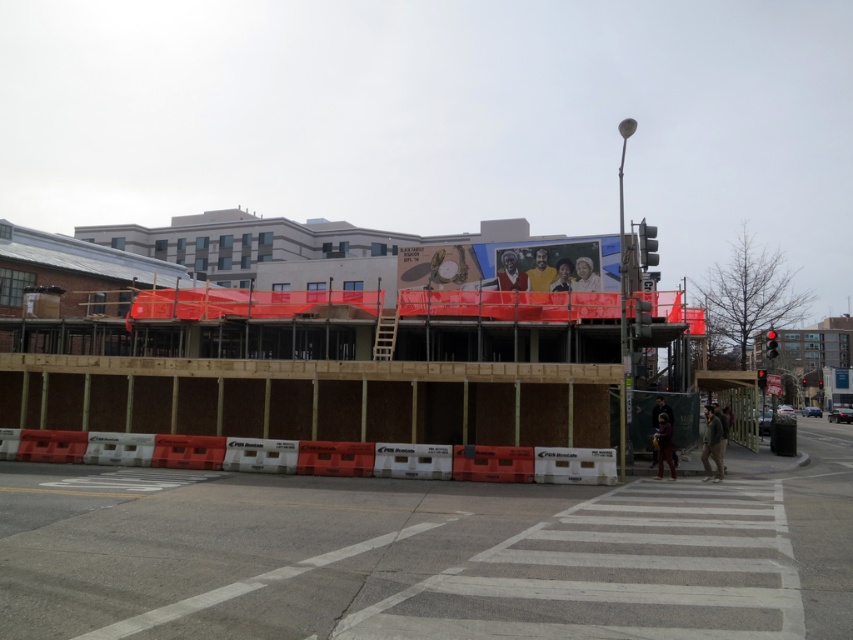
Question: Estimate the real-world distances between objects in this image. Which object is farther from the red glass traffic light at center?

Choices:
 (A) white plastic barricade at lower center
 (B) red glass traffic light at upper right

Answer: (A)

Question: Where is white plastic barricade at lower center located in relation to red glass traffic light at center in the image?

Choices:
 (A) above
 (B) below

Answer: (B)

Question: Which of the following is the farthest from the observer?

Choices:
 (A) red glass traffic light at center
 (B) white plastic barricade at lower center

Answer: (A)

Question: Which object is farther from the camera taking this photo?

Choices:
 (A) white plastic barricade at lower center
 (B) red glass traffic light at center

Answer: (B)

Question: Can you confirm if white plastic barricade at lower center is smaller than red glass traffic light at upper right?

Choices:
 (A) yes
 (B) no

Answer: (A)

Question: Does white plastic barricade at lower center appear over red glass traffic light at center?

Choices:
 (A) no
 (B) yes

Answer: (A)